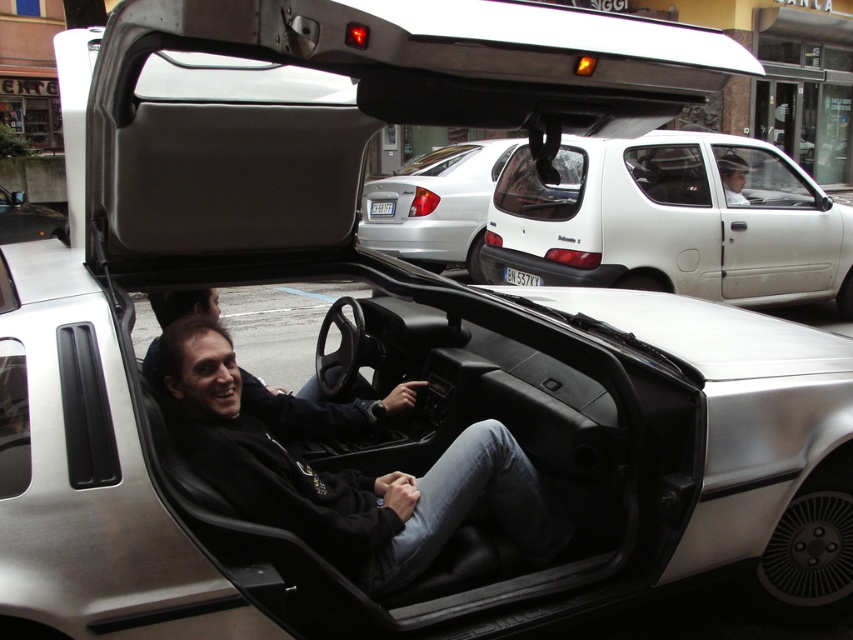
Question: In this image, where is matte black car at center located relative to black plastic license plate at center?

Choices:
 (A) below
 (B) above

Answer: (B)

Question: Which point appears closest to the camera in this image?

Choices:
 (A) (151, 374)
 (B) (668, 188)
 (C) (10, 198)

Answer: (A)

Question: Which point is farther from the camera taking this photo?

Choices:
 (A) (505, 276)
 (B) (732, 168)
 (C) (320, 440)
 (D) (410, 538)

Answer: (A)

Question: Is black leather jacket at center to the left of light blue shirt at center from the viewer's perspective?

Choices:
 (A) no
 (B) yes

Answer: (B)

Question: Can you confirm if matte black car at center is positioned to the left of light blue shirt at center?

Choices:
 (A) yes
 (B) no

Answer: (A)

Question: Which object appears farthest from the camera in this image?

Choices:
 (A) black plastic license plate at center
 (B) light blue shirt at center
 (C) matte black car at center

Answer: (B)